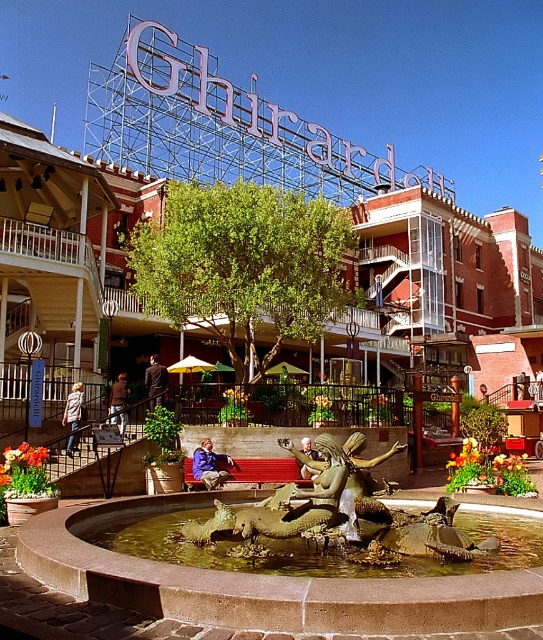
You are a tourist standing in the plaza and you see the bronze statue at center and the denim jacket at lower left. Which object is closer to the ground?

The bronze statue at center is located below denim jacket at lower left, so the bronze statue at center is closer to the ground.

You are a photographer wanting to capture both the bronze statue at center and the denim jacket at lower left in the same frame. Based on their sizes, which object should you focus on to ensure both are visible without needing to zoom in or out?

The bronze statue at center is taller than the denim jacket at lower left, so focusing on the bronze statue at center would ensure both are visible without adjusting the zoom.